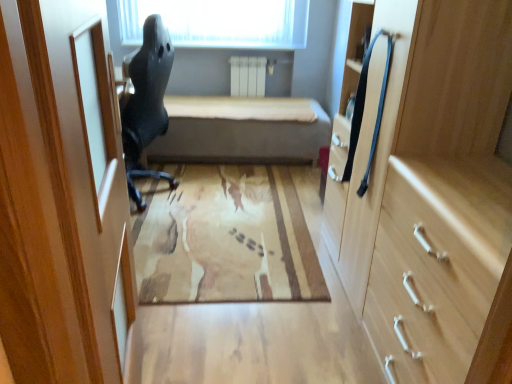
Question: Is beige fabric bed at center spatially inside light wood cabinet at right, or outside of it?

Choices:
 (A) inside
 (B) outside

Answer: (B)

Question: From the image's perspective, relative to light wood cabinet at right, is beige fabric bed at center above or below?

Choices:
 (A) above
 (B) below

Answer: (A)

Question: Which object is the farthest from the matte black chair at left?

Choices:
 (A) light wood drawer at right
 (B) beige fabric bed at center
 (C) wooden door at left
 (D) light wood cabinet at right

Answer: (A)

Question: Based on their relative distances, which object is farther from the wooden door at left?

Choices:
 (A) matte black chair at left
 (B) beige fabric bed at center
 (C) light wood cabinet at right
 (D) light wood drawer at right

Answer: (B)